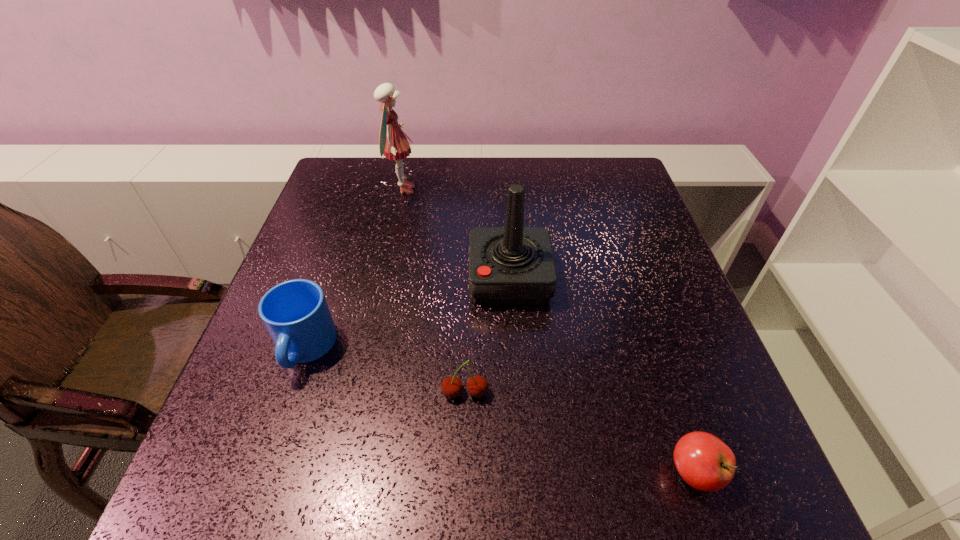
Locate an element on the screen. This screenshot has width=960, height=540. vacant area at the far edge of the desktop is located at coordinates (421, 171).

Locate an element on the screen. vacant space at the left edge is located at coordinates (273, 408).

Find the location of a particular element. The width and height of the screenshot is (960, 540). free space at the right edge is located at coordinates (693, 404).

Where is `free spot at the far left corner of the desktop`? free spot at the far left corner of the desktop is located at coordinates (329, 177).

Find the location of `free region at the near left corner of the desktop`. free region at the near left corner of the desktop is located at coordinates (250, 472).

This screenshot has height=540, width=960. Find the location of `free space at the far right corner`. free space at the far right corner is located at coordinates (612, 157).

In the image, there is a desktop. Identify the location of vacant space at the near right corner. This screenshot has width=960, height=540. click(x=773, y=499).

Find the location of a particular element. This screenshot has width=960, height=540. free spot between the joystick and the doll is located at coordinates (456, 234).

Where is `empty space that is in between the mug and the tallest object`? empty space that is in between the mug and the tallest object is located at coordinates (353, 269).

In order to click on vacant region between the rightmost object and the joystick in this screenshot , I will do `click(602, 375)`.